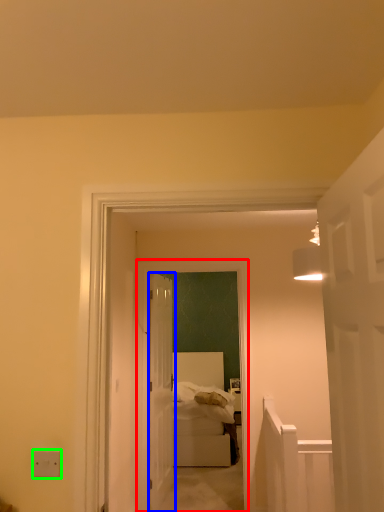
Question: Based on their relative distances, which object is nearer to corridor (highlighted by a red box)? Choose from door (highlighted by a blue box) and electric outlet (highlighted by a green box).

Choices:
 (A) door
 (B) electric outlet

Answer: (A)